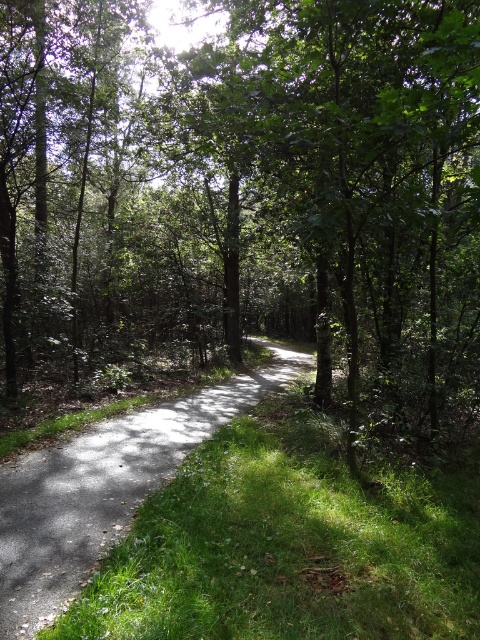
Does green leafy tree at center come in front of gray asphalt trail at center?

No, it is behind gray asphalt trail at center.

At what (x,y) coordinates should I click in order to perform the action: click on green leafy tree at center. Please return your answer as a coordinate pair (x, y). This screenshot has width=480, height=640. Looking at the image, I should click on (249, 193).